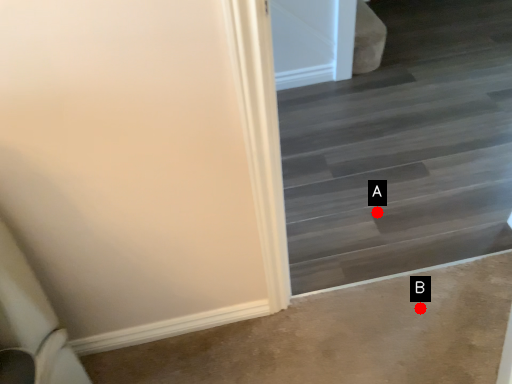
Question: Two points are circled on the image, labeled by A and B beside each circle. Which point appears closest to the camera in this image?

Choices:
 (A) A is closer
 (B) B is closer

Answer: (B)